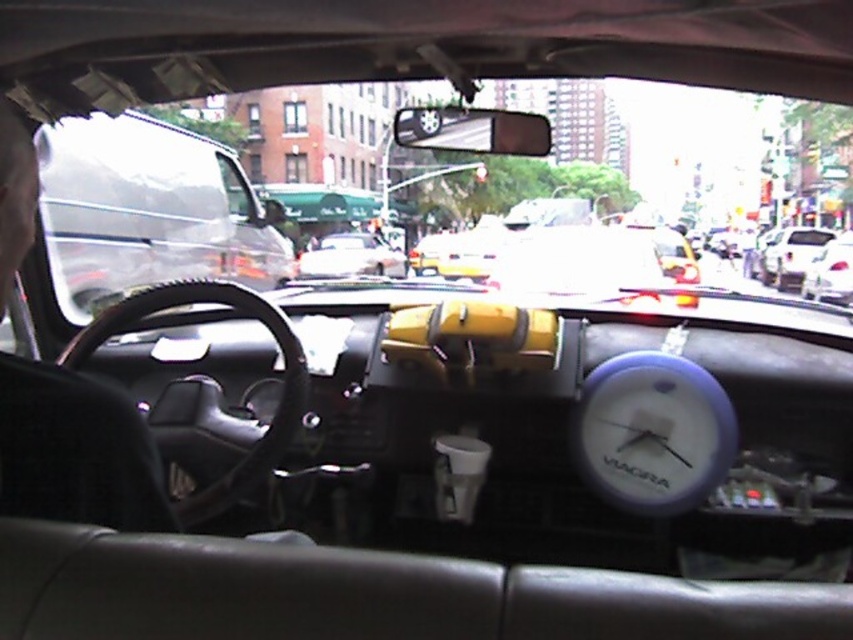
Question: Which object is the farthest from the white plastic clock at center?

Choices:
 (A) yellow matte taxi at center
 (B) white glossy sedan at right

Answer: (B)

Question: Which object appears closest to the camera in this image?

Choices:
 (A) white glossy sedan at right
 (B) white plastic clock at center
 (C) yellow matte taxi at center

Answer: (B)

Question: Considering the relative positions of yellow matte taxi at center and white glossy sedan at right in the image provided, where is yellow matte taxi at center located with respect to white glossy sedan at right?

Choices:
 (A) above
 (B) below

Answer: (B)

Question: Is white plastic clock at center to the right of white glossy sedan at right from the viewer's perspective?

Choices:
 (A) yes
 (B) no

Answer: (B)

Question: Which object is farther from the camera taking this photo?

Choices:
 (A) yellow matte taxi at center
 (B) white glossy sedan at right

Answer: (B)

Question: Can you confirm if yellow matte taxi at center is thinner than white glossy sedan at right?

Choices:
 (A) no
 (B) yes

Answer: (B)